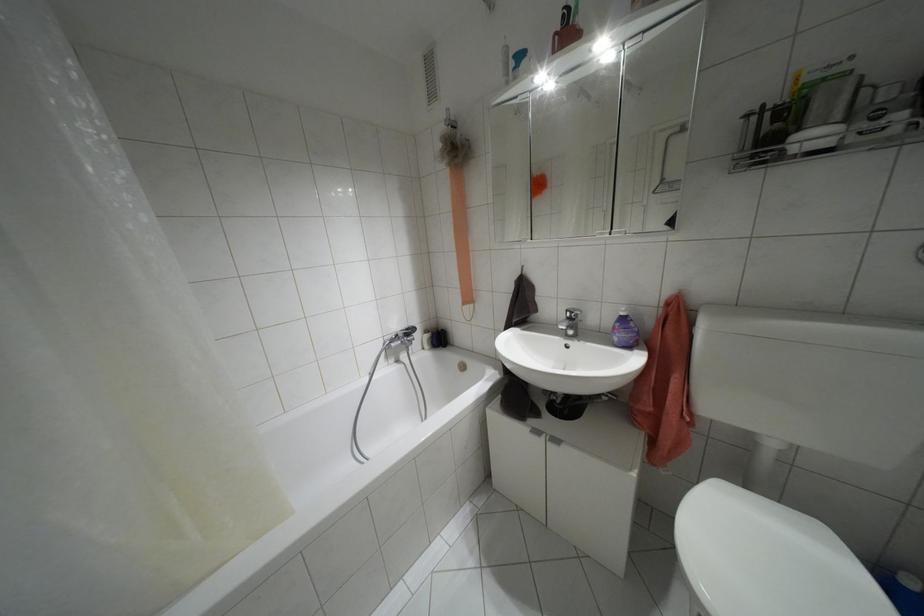
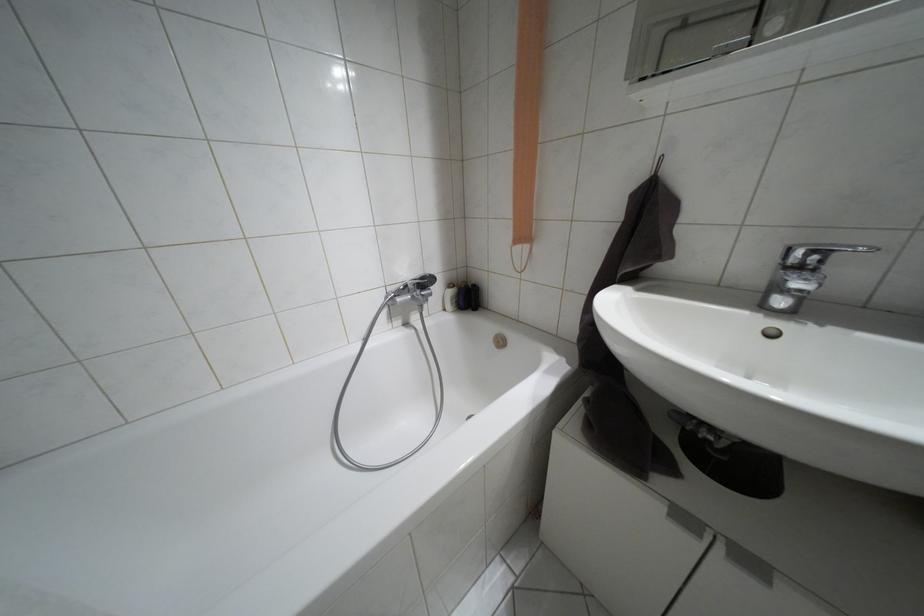
The point at (536, 431) is marked in the first image. Where is the corresponding point in the second image?

(684, 517)